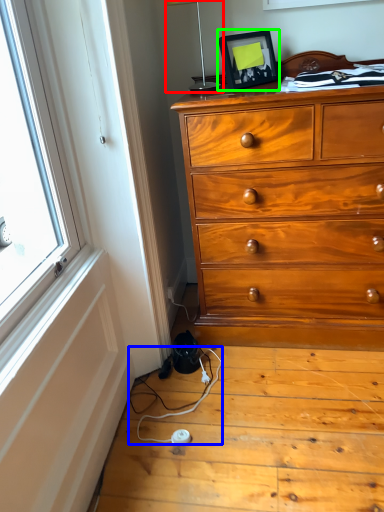
Question: Considering the real-world distances, which object is closest to table lamp (highlighted by a red box)? twin (highlighted by a blue box) or picture frame (highlighted by a green box).

Choices:
 (A) twin
 (B) picture frame

Answer: (B)